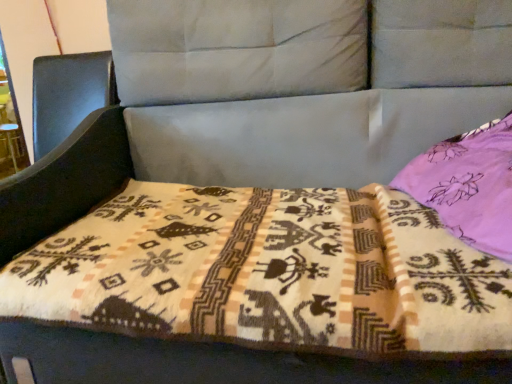
What do you see at coordinates (268, 273) in the screenshot? I see `white woolen blanket at center` at bounding box center [268, 273].

Find the location of a particular element. white woolen blanket at center is located at coordinates click(268, 273).

What is the approximate width of white woolen blanket at center?

82.49 centimeters.

You are a GUI agent. You are given a task and a screenshot of the screen. Output one action in this format:
    pyautogui.click(x=<x>, y=<y>)
    Task: Click on the white woolen blanket at center
    
    Given the screenshot: What is the action you would take?
    pyautogui.click(x=268, y=273)